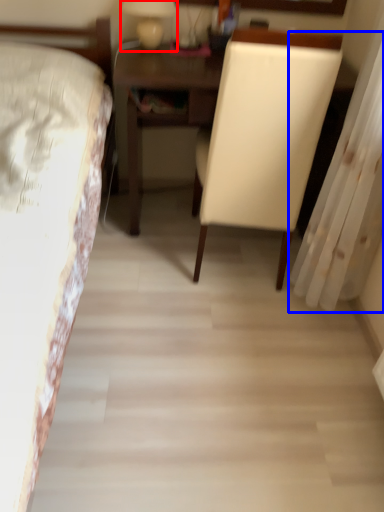
Question: Among these objects, which one is farthest to the camera, bedside lamp (highlighted by a red box) or curtain (highlighted by a blue box)?

Choices:
 (A) bedside lamp
 (B) curtain

Answer: (A)